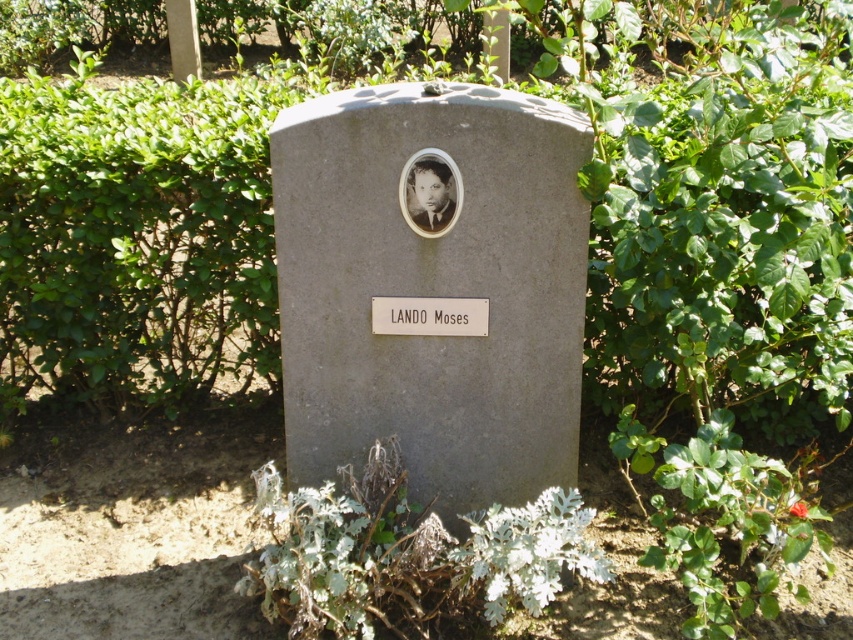
You are standing in front of the tombstone and want to place a bouquet of flowers. The bouquet is 20 cm wide. The gray stone gravestone at center and the matte black face at center are both flat surfaces. Which surface can the bouquet fit on without overhanging?

The gray stone gravestone at center has a larger size compared to matte black face at center, so the bouquet can fit on the gray stone gravestone at center without overhanging.

You are standing at the point labeled as point [432,289] in the image. What object are you directly in front of?

You are directly in front of the gray stone gravestone at center because the point [432,289] corresponds to it.

You are a landscape architect designing a new memorial garden. You need to place a decorative stone that is 12 inches wide between the gray stone gravestone at center and the matte black face at center. Will there be enough space?

The gray stone gravestone at center and matte black face at center are 13.35 inches apart, so placing a 12 inch wide decorative stone between them would fit since 12 inches is less than 13.35 inches.